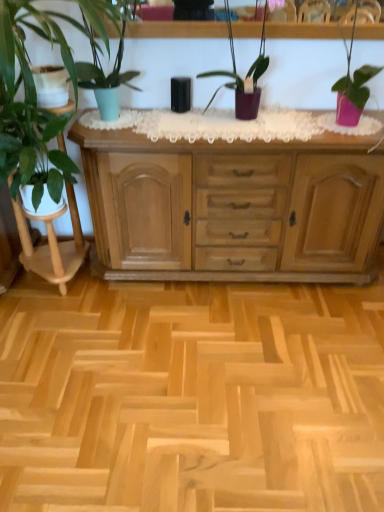
You are a GUI agent. You are given a task and a screenshot of the screen. Output one action in this format:
    pyautogui.click(x=<x>, y=<y>)
    Task: Click on the vacant area that lies in front of natural wood cabinet at center
    This screenshot has height=512, width=384.
    Given the screenshot: What is the action you would take?
    pyautogui.click(x=228, y=365)